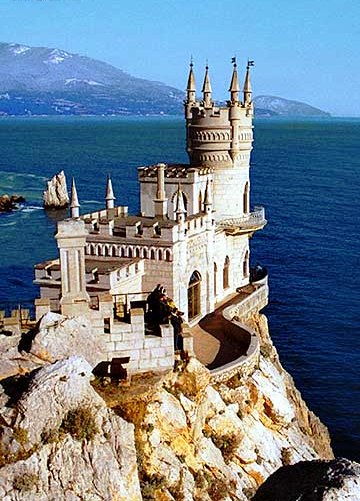
Find the location of a particular element. The height and width of the screenshot is (501, 360). window is located at coordinates (250, 266), (230, 272), (214, 280), (196, 293), (249, 197), (203, 200), (185, 197).